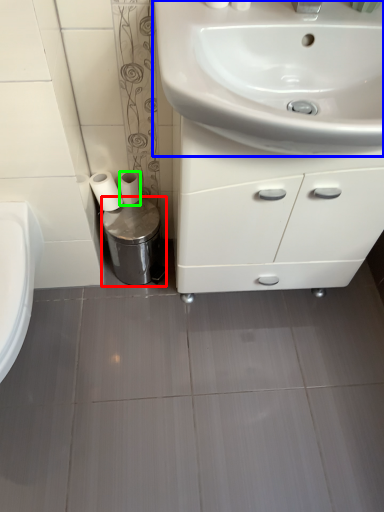
Question: Which object is positioned closest to bidet (highlighted by a red box)? Select from sink (highlighted by a blue box) and toilet paper (highlighted by a green box).

Choices:
 (A) sink
 (B) toilet paper

Answer: (B)